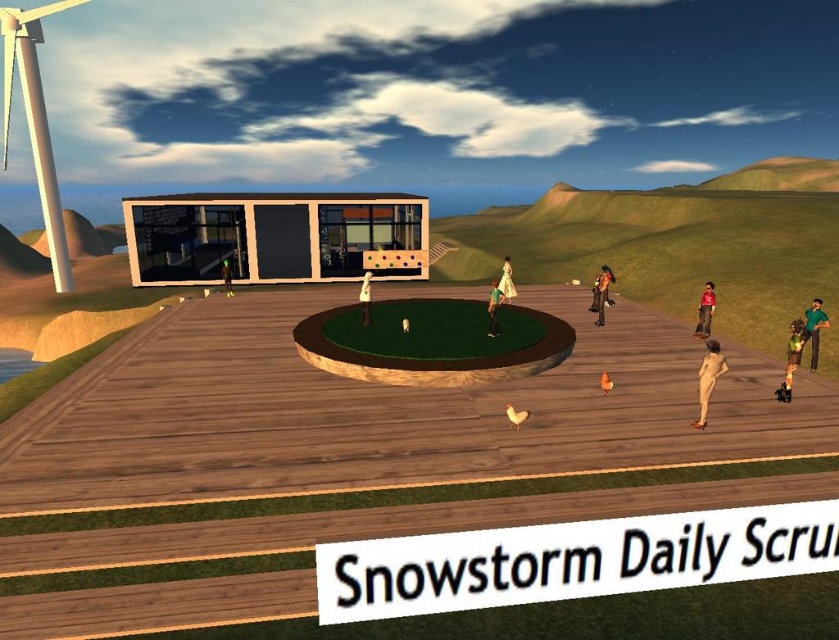
Question: Can you confirm if white matte wind turbine at upper left is positioned below nude skin at lower right?

Choices:
 (A) yes
 (B) no

Answer: (B)

Question: Considering the real-world distances, which object is closest to the green fabric dress at right?

Choices:
 (A) white matte wind turbine at upper left
 (B) green fabric dress at lower right

Answer: (B)

Question: In this image, where is green fabric dress at right located relative to white satin dress at center?

Choices:
 (A) below
 (B) above

Answer: (A)

Question: Which point is farther to the camera?

Choices:
 (A) (798, 317)
 (B) (228, 268)
 (C) (494, 321)

Answer: (B)

Question: Can you confirm if red fabric shirt at right is wider than white matte statue at center?

Choices:
 (A) no
 (B) yes

Answer: (B)

Question: Which object appears closest to the camera in this image?

Choices:
 (A) red fabric shirt at right
 (B) white matte wind turbine at upper left
 (C) white matte statue at center
 (D) white satin dress at center

Answer: (D)